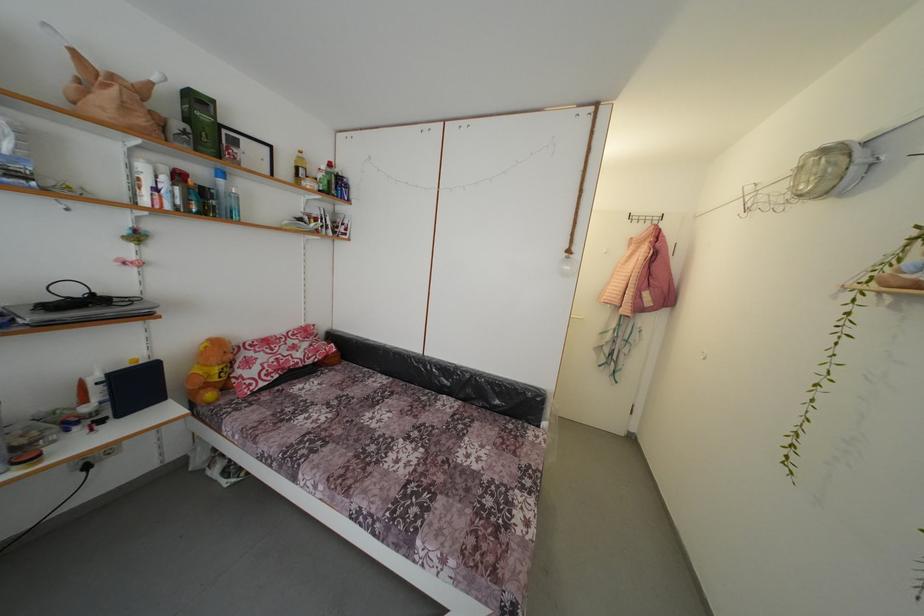
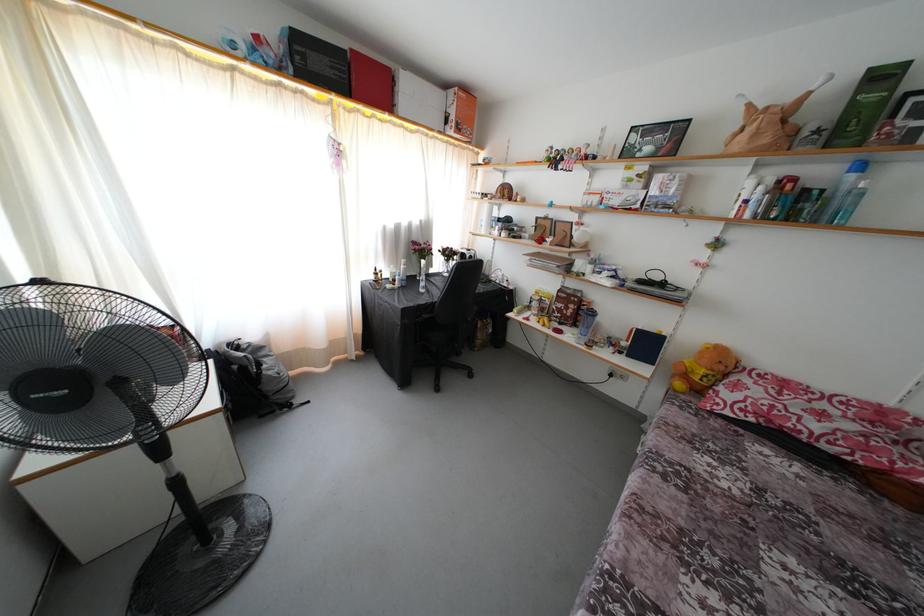
Locate, in the second image, the point that corresponds to (x=216, y=177) in the first image.

(849, 172)